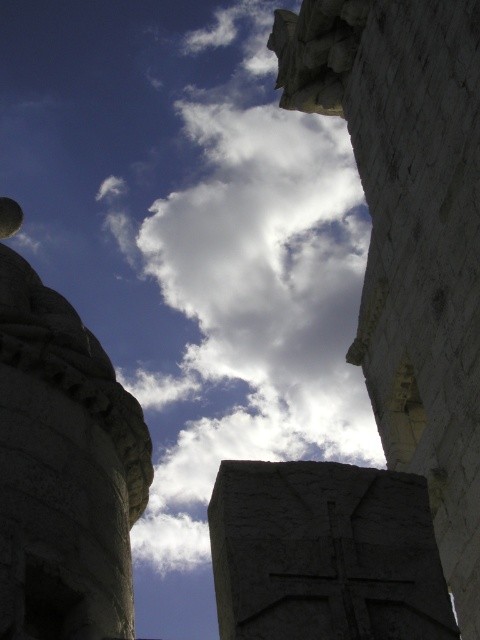
You are standing under the stone structure and looking up. You see the white stone pillar at upper center and the white fluffy cloud at center. Which one is closer to you?

The white fluffy cloud at center is closer to you because the white stone pillar at upper center is behind it.

You are standing at the base of the stone structure and looking upward. There are two points marked on the structure. The first point is at coordinates point (x=251, y=228) and the second is at point (x=375, y=124). Which point is closer to your viewpoint?

Point (x=375, y=124) is closer to your viewpoint because it is in front of point (x=251, y=228).